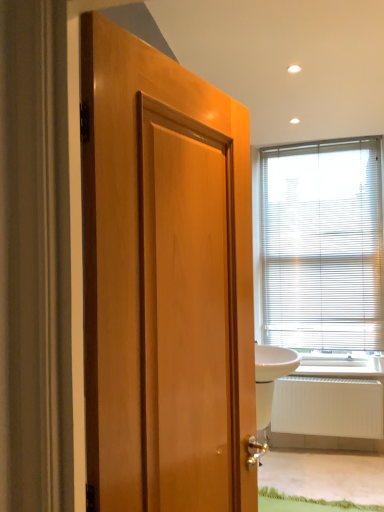
Question: From a real-world perspective, relative to white matte radiator at lower right, is wooden door at center vertically above or below?

Choices:
 (A) above
 (B) below

Answer: (A)

Question: From the image's perspective, is wooden door at center positioned above or below white matte radiator at lower right?

Choices:
 (A) below
 (B) above

Answer: (B)

Question: Considering the real-world distances, which object is farthest from the wooden door at center?

Choices:
 (A) white plastic blinds at upper right
 (B) white glossy sink at right
 (C) white matte radiator at lower right

Answer: (A)

Question: Based on their relative distances, which object is farther from the white matte radiator at lower right?

Choices:
 (A) white glossy sink at right
 (B) wooden door at center
 (C) white plastic blinds at upper right

Answer: (B)